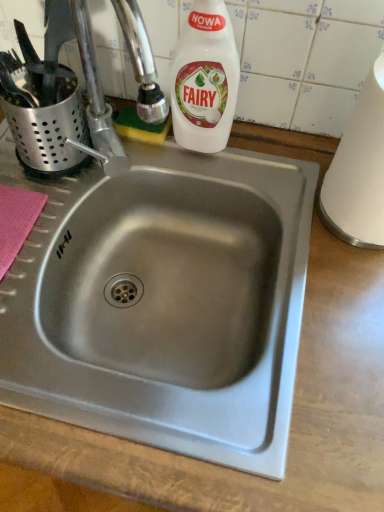
Question: Considering the positions of white plastic bottle at upper center and white matte paper towel at right in the image, is white plastic bottle at upper center wider or thinner than white matte paper towel at right?

Choices:
 (A) wide
 (B) thin

Answer: (B)

Question: Based on their positions, is white plastic bottle at upper center located to the left or right of white matte paper towel at right?

Choices:
 (A) right
 (B) left

Answer: (B)

Question: Is white plastic bottle at upper center spatially inside white matte paper towel at right, or outside of it?

Choices:
 (A) outside
 (B) inside

Answer: (A)

Question: Looking at the image, does white matte paper towel at right seem bigger or smaller compared to white plastic bottle at upper center?

Choices:
 (A) big
 (B) small

Answer: (A)

Question: Considering the relative positions of white matte paper towel at right and white plastic bottle at upper center in the image provided, is white matte paper towel at right to the left or to the right of white plastic bottle at upper center?

Choices:
 (A) right
 (B) left

Answer: (A)

Question: Would you say white matte paper towel at right is inside or outside white plastic bottle at upper center?

Choices:
 (A) outside
 (B) inside

Answer: (A)

Question: From a real-world perspective, is white matte paper towel at right above or below white plastic bottle at upper center?

Choices:
 (A) above
 (B) below

Answer: (A)